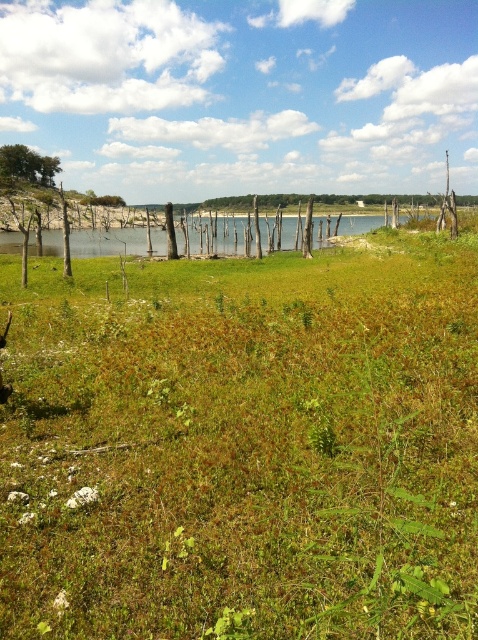
Which is more to the right, green grassy at center or green leafy tree at upper left?

green grassy at center is more to the right.

Does point (145, 280) lie in front of point (58, 161)?

Yes, point (145, 280) is closer to viewer.

Find the location of a particular element. This screenshot has width=478, height=640. green grassy at center is located at coordinates (243, 449).